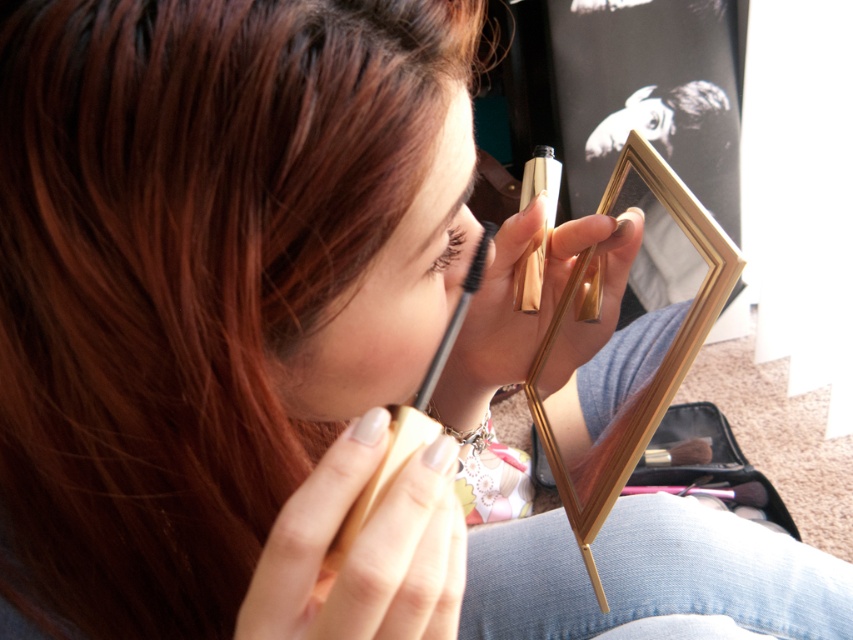
You are a makeup artist who needs to place a 30 inch long ribbon between the black matte brush at center and the brown wooden brush at lower center. Can you fit the ribbon between them without moving either brush?

The black matte brush at center and brown wooden brush at lower center are 34.00 inches apart, so yes, the 30 inch long ribbon can fit between them since the distance is greater than the ribbon length.

You are a photographer adjusting your camera focus. You notice two points in the image at coordinates point (450,250) and point (456,244). Which point should you focus on to ensure it appears sharper in the photo?

Point (450,250) should be focused on because it is closer to the camera than point (456,244), making it easier to capture sharply.

You are a makeup artist who needs to choose between the black matte brush at center and the brown wooden brush at lower center for a precise eyeshadow application. Based on their sizes, which brush would be more suitable for detailed work?

The black matte brush at center has a greater height compared to the brown wooden brush at lower center, making it more suitable for detailed eyeshadow application due to its longer bristles allowing for better control and precision.